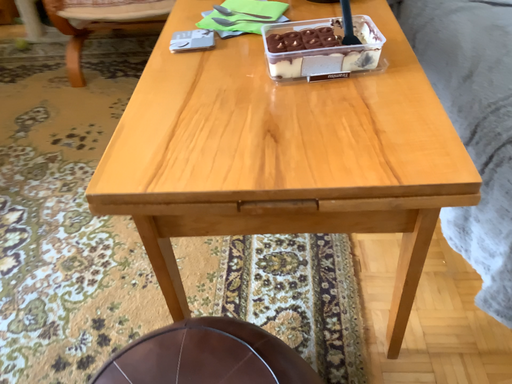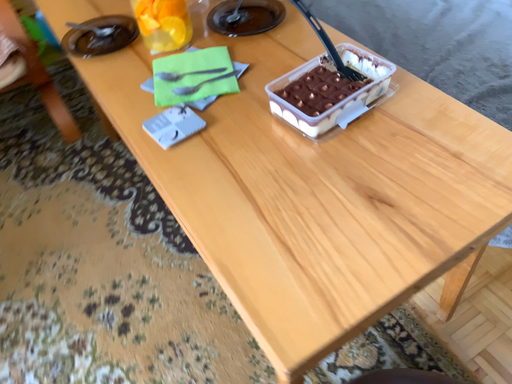
Question: Which way did the camera rotate in the video?

Choices:
 (A) rotated right
 (B) rotated left

Answer: (A)